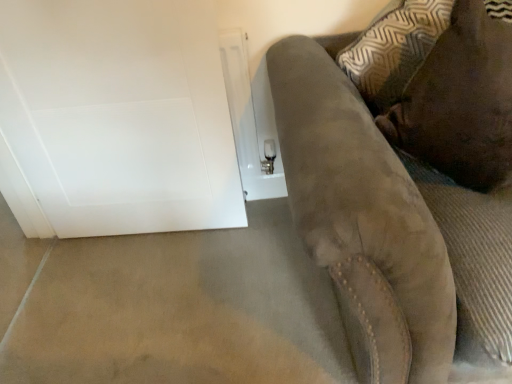
This screenshot has height=384, width=512. I want to click on vacant region in front of white glossy door at left, so click(x=142, y=302).